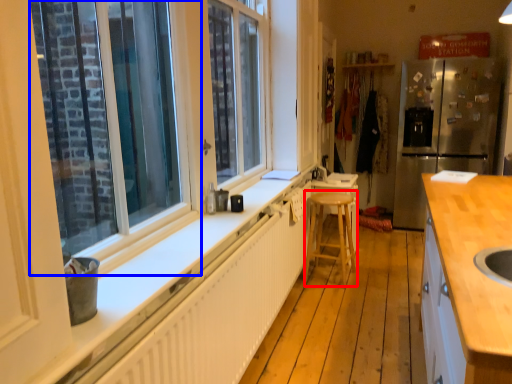
Question: Which object appears closest to the camera in this image, bar stool (highlighted by a red box) or window (highlighted by a blue box)?

Choices:
 (A) bar stool
 (B) window

Answer: (B)